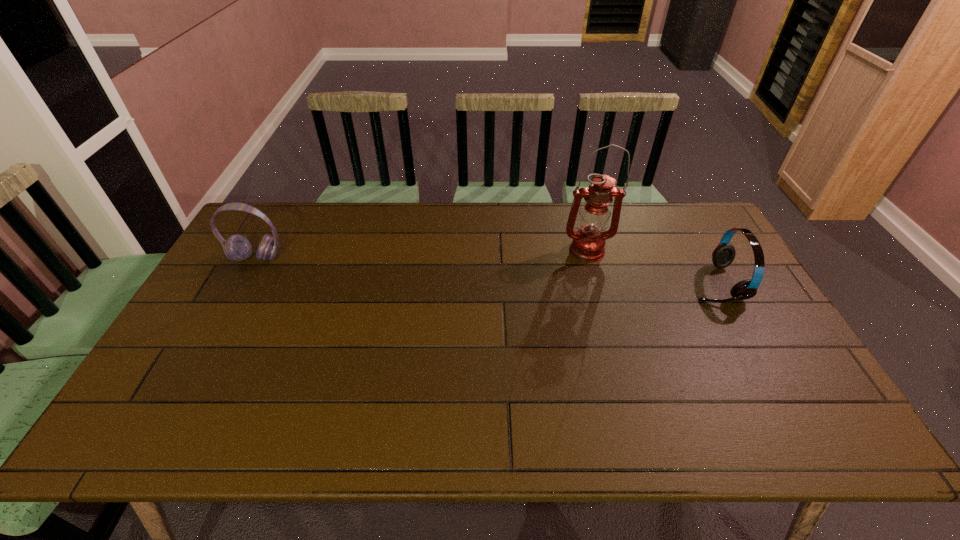
The width and height of the screenshot is (960, 540). Find the location of `object located at the far edge`. object located at the far edge is located at coordinates (588, 243).

This screenshot has height=540, width=960. Identify the location of object positioned at the left edge. (237, 248).

What are the coordinates of `object at the right edge` in the screenshot? It's located at (723, 255).

I want to click on free spot at the far edge of the desktop, so click(557, 210).

Image resolution: width=960 pixels, height=540 pixels. I want to click on vacant space at the near edge of the desktop, so click(409, 426).

This screenshot has height=540, width=960. Identify the location of vacant space at the right edge of the desktop. (738, 373).

I want to click on free spot at the far left corner of the desktop, so (x=280, y=227).

Locate an element on the screen. The width and height of the screenshot is (960, 540). vacant space at the near left corner of the desktop is located at coordinates (145, 427).

At what (x,y) coordinates should I click in order to perform the action: click on free space at the far right corner of the desktop. Please return your answer as a coordinate pair (x, y). The width and height of the screenshot is (960, 540). Looking at the image, I should click on (673, 235).

Locate an element on the screen. free area in between the left headset and the right headset is located at coordinates (486, 271).